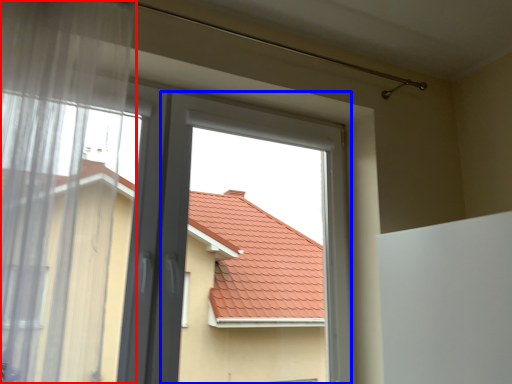
Question: Which object appears closest to the camera in this image, window (highlighted by a red box) or bay window (highlighted by a blue box)?

Choices:
 (A) window
 (B) bay window

Answer: (A)